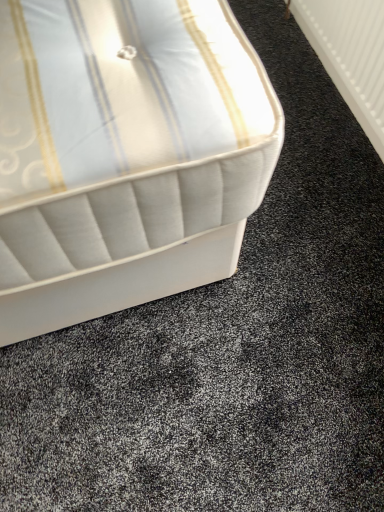
You are a GUI agent. You are given a task and a screenshot of the screen. Output one action in this format:
    pyautogui.click(x=<x>, y=<y>)
    Task: Click on the white fabric bed at upper left
    The width and height of the screenshot is (384, 512).
    Given the screenshot: What is the action you would take?
    pyautogui.click(x=125, y=154)

This screenshot has height=512, width=384. Describe the element at coordinates (125, 154) in the screenshot. I see `white fabric bed at upper left` at that location.

Describe the element at coordinates (350, 54) in the screenshot. Image resolution: width=384 pixels, height=512 pixels. I see `white plastic radiator at upper right` at that location.

Measure the distance between white plastic radiator at upper right and camera.

They are 1.07 meters apart.

Measure the distance between point (x=339, y=32) and camera.

The distance of point (x=339, y=32) from camera is 4.34 feet.

Where is `white plastic radiator at upper right`? Image resolution: width=384 pixels, height=512 pixels. white plastic radiator at upper right is located at coordinates (350, 54).

Identify the location of white fabric bed at upper left. This screenshot has height=512, width=384. (125, 154).

In the scene shown: Considering the positions of objects white plastic radiator at upper right and white fabric bed at upper left in the image provided, who is more to the left, white plastic radiator at upper right or white fabric bed at upper left?

Positioned to the left is white fabric bed at upper left.

In the image, is white plastic radiator at upper right positioned in front of or behind white fabric bed at upper left?

white plastic radiator at upper right is behind white fabric bed at upper left.

Considering the positions of points (374, 136) and (267, 119), is point (374, 136) closer to camera compared to point (267, 119)?

No, it is not.

From the image's perspective, does white plastic radiator at upper right appear lower than white fabric bed at upper left?

No.

From a real-world perspective, is white plastic radiator at upper right positioned over white fabric bed at upper left based on gravity?

Yes, from a real-world perspective, white plastic radiator at upper right is above white fabric bed at upper left.

In terms of width, does white plastic radiator at upper right look wider or thinner when compared to white fabric bed at upper left?

In the image, white plastic radiator at upper right appears to be more narrow than white fabric bed at upper left.

Can you confirm if white plastic radiator at upper right is shorter than white fabric bed at upper left?

No.

Who is smaller, white plastic radiator at upper right or white fabric bed at upper left?

Smaller between the two is white plastic radiator at upper right.

Could white fabric bed at upper left be considered to be inside white plastic radiator at upper right?

No, white fabric bed at upper left is not surrounded by white plastic radiator at upper right.

Is white plastic radiator at upper right far away from white fabric bed at upper left?

No, white plastic radiator at upper right is not far away from white fabric bed at upper left.

Could you tell me if white plastic radiator at upper right is facing white fabric bed at upper left?

No, white plastic radiator at upper right does not turn towards white fabric bed at upper left.

Can you tell me how much white plastic radiator at upper right and white fabric bed at upper left differ in facing direction?

The angular difference between white plastic radiator at upper right and white fabric bed at upper left is 86.5 degrees.

Consider the image. Measure the distance from white plastic radiator at upper right to white fabric bed at upper left.

32.06 inches.

Locate an element on the screen. bed that appears in front of the white plastic radiator at upper right is located at coordinates (125, 154).

Which is more to the left, white fabric bed at upper left or white plastic radiator at upper right?

From the viewer's perspective, white fabric bed at upper left appears more on the left side.

Which is behind, white fabric bed at upper left or white plastic radiator at upper right?

white plastic radiator at upper right is further away from the camera.

Does point (190, 65) appear closer or farther from the camera than point (357, 3)?

Clearly, point (190, 65) is closer to the camera than point (357, 3).

From the image's perspective, does white fabric bed at upper left appear lower than white plastic radiator at upper right?

Yes, from the image's perspective, white fabric bed at upper left is beneath white plastic radiator at upper right.

From a real-world perspective, is white fabric bed at upper left positioned over white plastic radiator at upper right based on gravity?

No.

Can you confirm if white fabric bed at upper left is thinner than white plastic radiator at upper right?

Incorrect, the width of white fabric bed at upper left is not less than that of white plastic radiator at upper right.

Who is taller, white fabric bed at upper left or white plastic radiator at upper right?

Standing taller between the two is white plastic radiator at upper right.

Considering the relative sizes of white fabric bed at upper left and white plastic radiator at upper right in the image provided, is white fabric bed at upper left smaller than white plastic radiator at upper right?

No, white fabric bed at upper left is not smaller than white plastic radiator at upper right.

Is white plastic radiator at upper right surrounded by white fabric bed at upper left?

No, white plastic radiator at upper right is located outside of white fabric bed at upper left.

Is white fabric bed at upper left in contact with white plastic radiator at upper right?

No, white fabric bed at upper left is not beside white plastic radiator at upper right.

From the picture: Is white fabric bed at upper left looking in the opposite direction of white plastic radiator at upper right?

white fabric bed at upper left is not turned away from white plastic radiator at upper right.

What's the angular difference between white fabric bed at upper left and white plastic radiator at upper right's facing directions?

86.5 degrees.

Where is `bed below the white plastic radiator at upper right (from a real-world perspective)`? This screenshot has height=512, width=384. bed below the white plastic radiator at upper right (from a real-world perspective) is located at coordinates (125, 154).

What are the coordinates of `bed in front of the white plastic radiator at upper right` in the screenshot? It's located at (125, 154).

In the image, there is a white plastic radiator at upper right. At what (x,y) coordinates should I click in order to perform the action: click on bed below it (from the image's perspective). Please return your answer as a coordinate pair (x, y). Image resolution: width=384 pixels, height=512 pixels. Looking at the image, I should click on (125, 154).